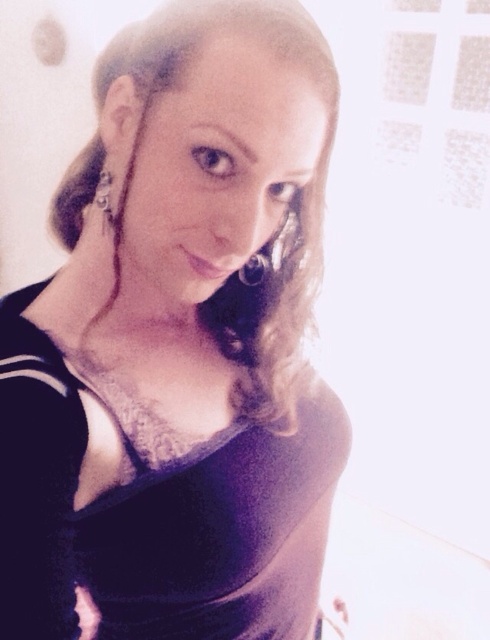
You are a photographer adjusting lighting for a photoshoot. You notice the matte black dress at center and the silver metallic earring at left. Which object should you focus your spotlight on to ensure it stands out against the overexposed background?

The silver metallic earring at left should be focused on because it is positioned above the matte black dress at center, making it closer to the light source and thus more likely to catch the spotlight effectively against the overexposed background.

Please describe the exact location of the matte black dress at center in the image using coordinates. The coordinate system has the origin at the bottom left corner of the image, with x increasing to the right and y increasing upwards.

The matte black dress at center is located at coordinates point (178,346).

You are a photographer adjusting the camera settings for a portrait. The subject is wearing a matte black dress at center and has a silver metallic earring at left. To ensure both the dress and earring are in focus, where should you position the focus point?

You should position the focus point on the matte black dress at center because it is taller than the silver metallic earring at left, making it the primary subject in the frame.